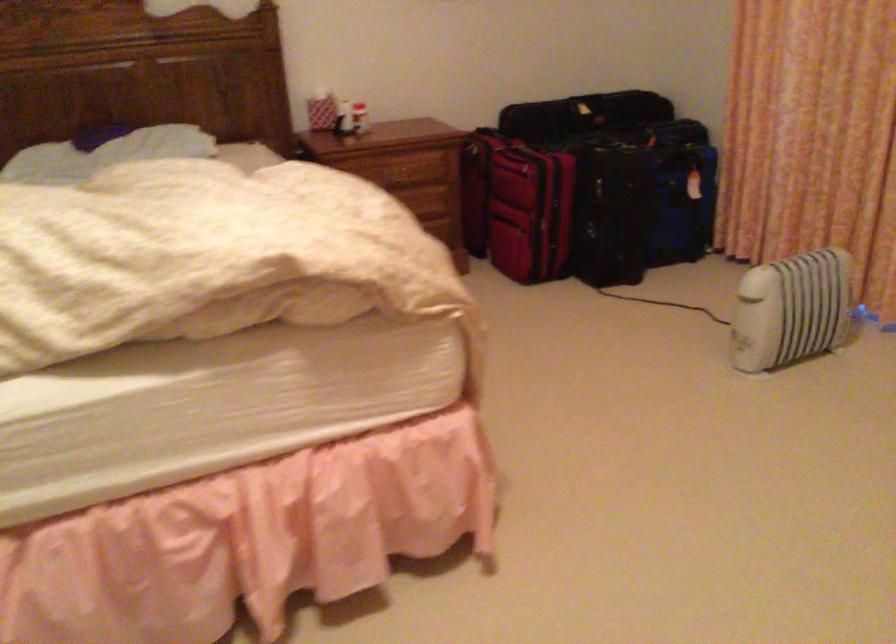
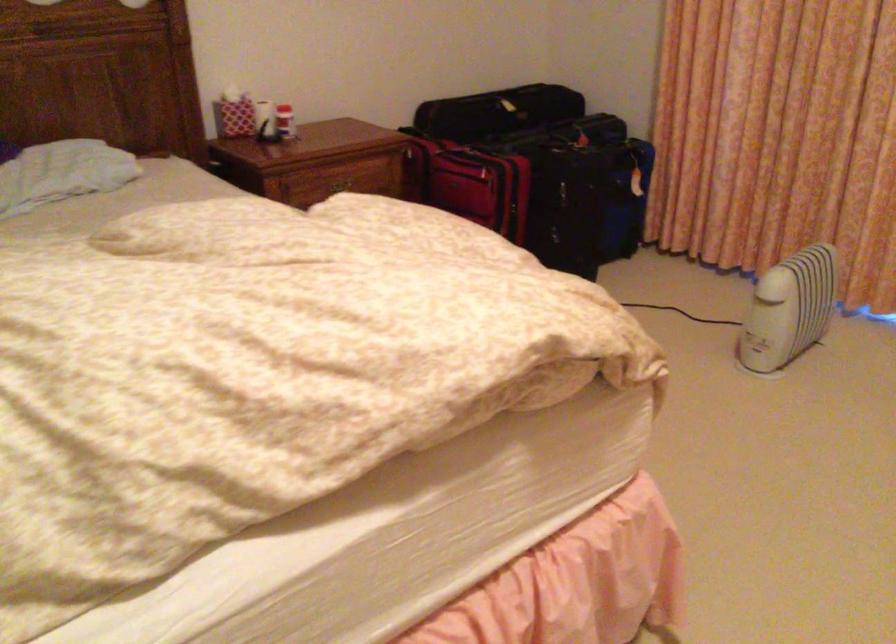
Where in the second image is the point corresponding to [757,313] from the first image?

(789, 308)